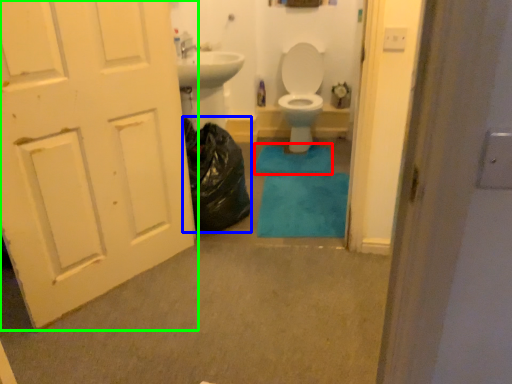
Question: Which object is positioned closest to bath mat (highlighted by a red box)? Select from garbage (highlighted by a blue box) and door (highlighted by a green box).

Choices:
 (A) garbage
 (B) door

Answer: (A)